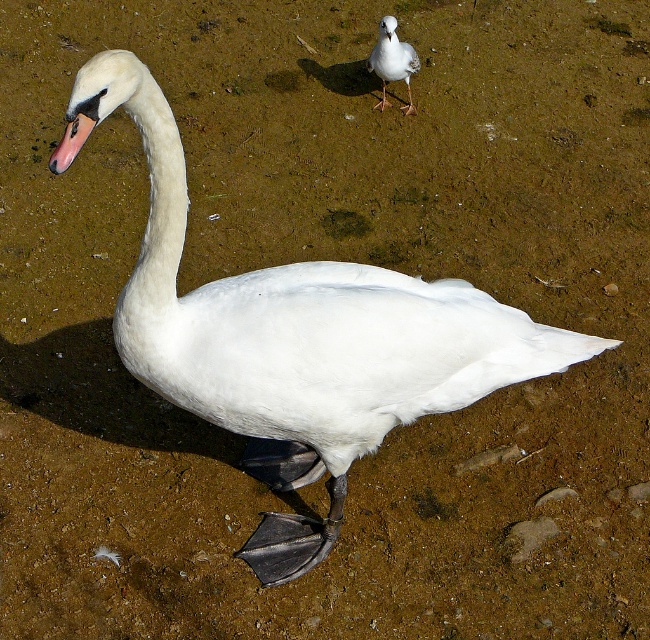
Can you confirm if white feathered bird at upper center is taller than pink matte beak at center-left?

Correct, white feathered bird at upper center is much taller as pink matte beak at center-left.

The image size is (650, 640). In order to click on white feathered bird at upper center in this screenshot , I will do `click(393, 61)`.

Identify the location of white feathered bird at upper center. coord(393,61).

Where is `white feathered bird at upper center`? white feathered bird at upper center is located at coordinates (393, 61).